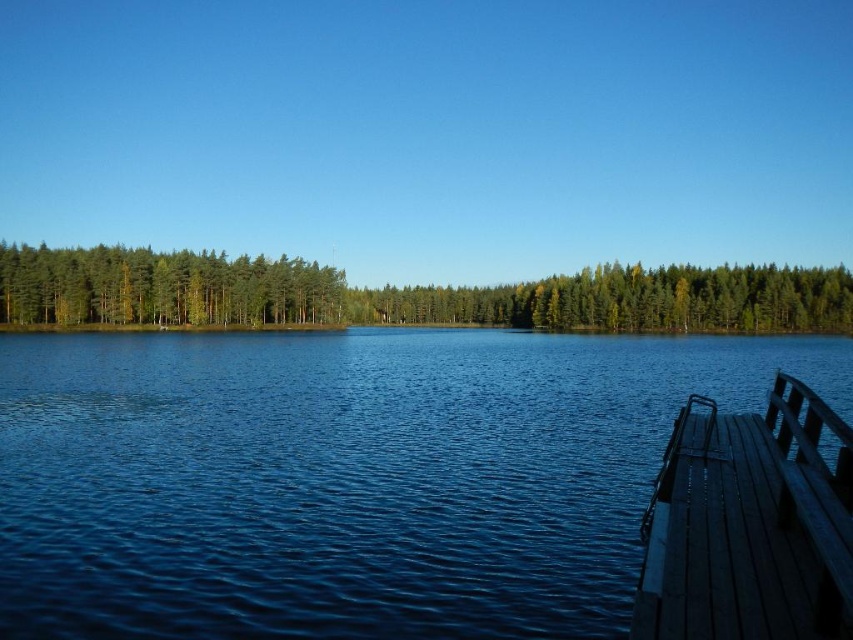
You are standing at the lakeside and want to walk to the green matte trees at left. Which direction should you move relative to the wooden dock at lower right?

Since the wooden dock at lower right is closer to you than the green matte trees at left, you should move away from the wooden dock at lower right to reach the green matte trees at left.

You are standing at the wooden dock at lower right and want to take a photo of the green matte trees at upper center. Which direction should you face to capture them in your view?

The green matte trees at upper center are positioned on the left side of the wooden dock at lower right, so you should face to the left to capture them in your view.